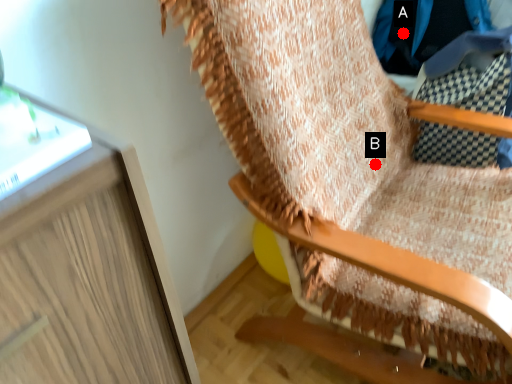
Question: Two points are circled on the image, labeled by A and B beside each circle. Which of the following is the closest to the observer?

Choices:
 (A) A is closer
 (B) B is closer

Answer: (B)